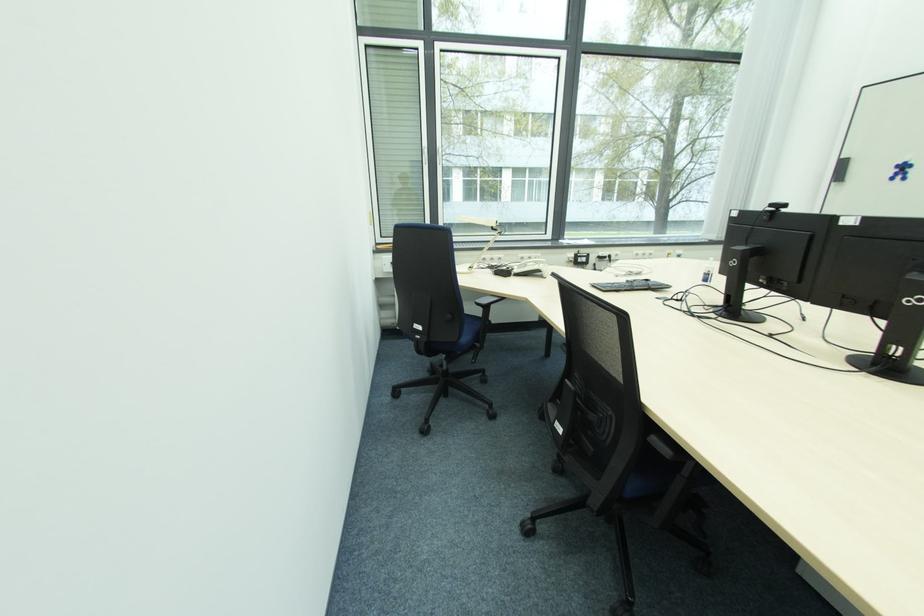
Find the location of a particular element. This screenshot has width=924, height=616. telephone handset is located at coordinates (531, 268).